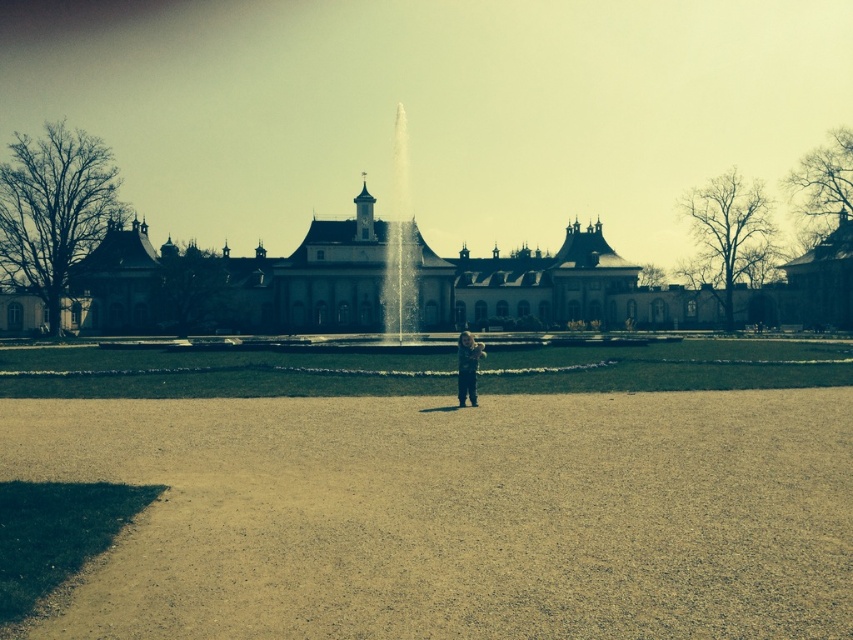
You are a photographer standing in front of the historic building. You want to capture a photo of the light brown fabric child at center and the clear glass water at center. Which object should you adjust your camera focus on first if you want the child to be in the foreground and the water in the background?

The light brown fabric child at center should be focused on first since it is closer to the photographer than the clear glass water at center, which is further away.

You are standing at the entrance of the historic building and want to walk to the fountain. Which object, the brown gravel path at center or the clear glass water at center, should you step on to reach the fountain safely?

You should step on the brown gravel path at center because it is located below the clear glass water at center, indicating that the gravel path is the solid ground beneath the water feature, making it safe for walking.

You are standing at the fountain in the center of the scene. You see two points marked in the image. Which point is closer to you, point (403,188) or point (467,342)?

Point (467,342) is closer to you because it is in front of point (403,188) according to their spatial relationship.